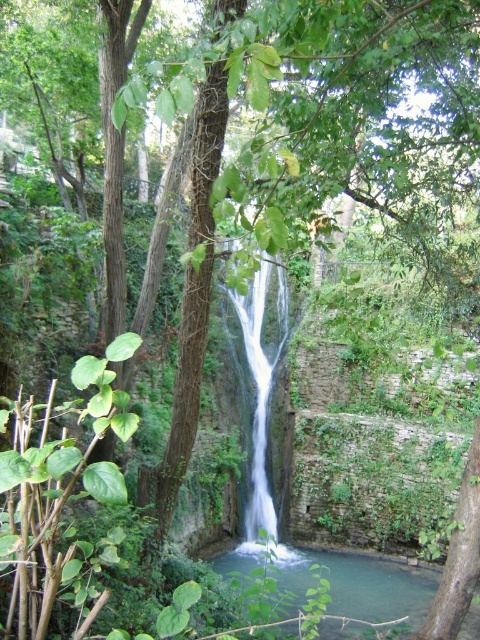
Which is below, clear water at center or white smooth waterfall at center?

clear water at center is below.

Who is more distant from viewer, (369, 605) or (259, 298)?

The point (259, 298) is more distant.

Find the location of a particular element. The image size is (480, 640). clear water at center is located at coordinates (359, 584).